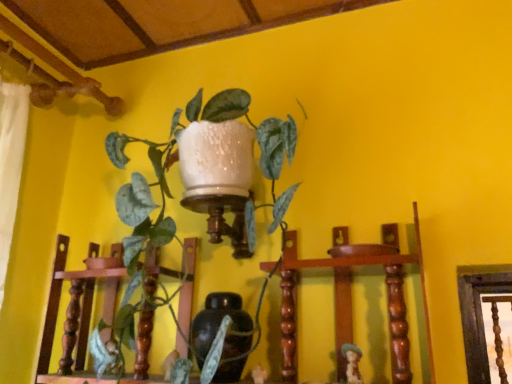
What do you see at coordinates (217, 321) in the screenshot?
I see `matte brown vase at center` at bounding box center [217, 321].

You are a GUI agent. You are given a task and a screenshot of the screen. Output one action in this format:
    pyautogui.click(x=<x>, y=<y>)
    Task: Click on the green glossy plant at upper center
    Image resolution: width=512 pixels, height=384 pixels.
    Given the screenshot: What is the action you would take?
    pyautogui.click(x=144, y=197)

Describe the element at coordinates (352, 363) in the screenshot. This screenshot has width=512, height=384. I see `matte brown figurine at lower right` at that location.

The width and height of the screenshot is (512, 384). What are the coordinates of `matte brown vase at center` in the screenshot? It's located at (217, 321).

Is matte brown figurine at lower right located outside green glossy plant at upper center?

Indeed, matte brown figurine at lower right is completely outside green glossy plant at upper center.

The width and height of the screenshot is (512, 384). What are the coordinates of `houseplant above the matte brown figurine at lower right (from a real-world perspective)` in the screenshot? It's located at [144, 197].

From the image's perspective, relative to green glossy plant at upper center, is matte brown figurine at lower right above or below?

matte brown figurine at lower right is situated lower than green glossy plant at upper center in the image.

How different are the orientations of matte brown figurine at lower right and green glossy plant at upper center in degrees?

matte brown figurine at lower right and green glossy plant at upper center are facing 0.00255 degrees away from each other.

Considering the relative positions of green glossy plant at upper center and matte brown figurine at lower right in the image provided, is green glossy plant at upper center to the right of matte brown figurine at lower right from the viewer's perspective?

Incorrect, green glossy plant at upper center is not on the right side of matte brown figurine at lower right.

Identify the location of houseplant above the matte brown figurine at lower right (from a real-world perspective). The height and width of the screenshot is (384, 512). (144, 197).

Is green glossy plant at upper center spatially inside matte brown figurine at lower right, or outside of it?

green glossy plant at upper center is not enclosed by matte brown figurine at lower right.

From the image's perspective, between green glossy plant at upper center and matte brown figurine at lower right, who is located below?

matte brown figurine at lower right is shown below in the image.

Is point (130, 191) behind point (231, 294)?

No, it is in front of (231, 294).

Is green glossy plant at upper center next to matte brown vase at center and touching it?

No, green glossy plant at upper center is not next to matte brown vase at center.

From the image's perspective, is green glossy plant at upper center located above or below matte brown vase at center?

From the image's perspective, green glossy plant at upper center appears above matte brown vase at center.

Is green glossy plant at upper center inside the boundaries of matte brown vase at center, or outside?

The correct answer is: outside.

From a real-world perspective, which object rests below the other?

In real-world perspective, matte brown figurine at lower right is lower.

Between matte brown vase at center and matte brown figurine at lower right, which one has larger size?

matte brown vase at center.

Identify the location of toy on the right of matte brown vase at center. (352, 363).

Is point (202, 311) less distant than point (347, 346)?

No, (202, 311) is behind (347, 346).

Considering the positions of objects matte brown figurine at lower right and matte brown vase at center in the image provided, who is more to the right, matte brown figurine at lower right or matte brown vase at center?

matte brown figurine at lower right is more to the right.

Would you say matte brown figurine at lower right is outside matte brown vase at center?

Absolutely, matte brown figurine at lower right is external to matte brown vase at center.

From a real-world perspective, which object stands above the other?

In real-world perspective, matte brown vase at center is above.

Is matte brown vase at center not close to green glossy plant at upper center?

No, there isn't a large distance between matte brown vase at center and green glossy plant at upper center.

Is matte brown vase at center inside the boundaries of green glossy plant at upper center, or outside?

matte brown vase at center fits inside green glossy plant at upper center.

Which object is closer to the camera, matte brown vase at center or green glossy plant at upper center?

green glossy plant at upper center is closer to the camera.

Can you tell me how much matte brown vase at center and green glossy plant at upper center differ in facing direction?

The angle between the facing direction of matte brown vase at center and the facing direction of green glossy plant at upper center is 0.0012 degrees.

Locate an element on the screen. toy directly beneath the green glossy plant at upper center (from a real-world perspective) is located at coordinates (352, 363).

This screenshot has height=384, width=512. What are the coordinates of `houseplant above the matte brown figurine at lower right (from the image's perspective)` in the screenshot? It's located at (144, 197).

Considering their positions, is matte brown vase at center positioned closer to green glossy plant at upper center than matte brown figurine at lower right?

The object closer to green glossy plant at upper center is matte brown vase at center.

Estimate the real-world distances between objects in this image. Which object is closer to matte brown figurine at lower right, green glossy plant at upper center or matte brown vase at center?

matte brown vase at center.

Based on their spatial positions, is green glossy plant at upper center or matte brown figurine at lower right closer to matte brown vase at center?

The object closer to matte brown vase at center is green glossy plant at upper center.

Based on their spatial positions, is matte brown figurine at lower right or matte brown vase at center further from green glossy plant at upper center?

matte brown figurine at lower right lies further to green glossy plant at upper center than the other object.

Considering their positions, is matte brown vase at center positioned closer to matte brown figurine at lower right than green glossy plant at upper center?

Among the two, matte brown vase at center is located nearer to matte brown figurine at lower right.

Looking at the image, which one is located further to matte brown vase at center, matte brown figurine at lower right or green glossy plant at upper center?

matte brown figurine at lower right lies further to matte brown vase at center than the other object.

Identify the location of vase between green glossy plant at upper center and matte brown figurine at lower right in the horizontal direction. (217, 321).